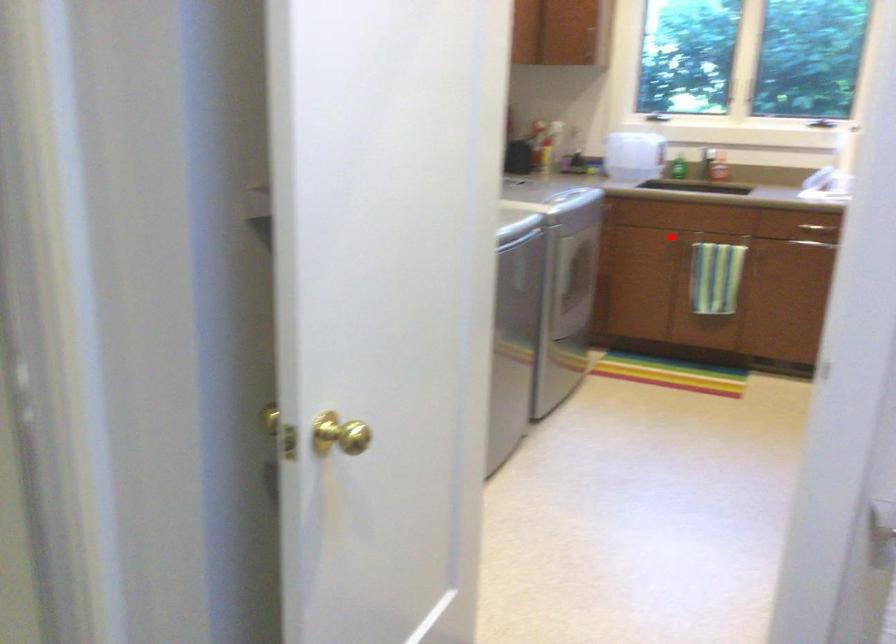
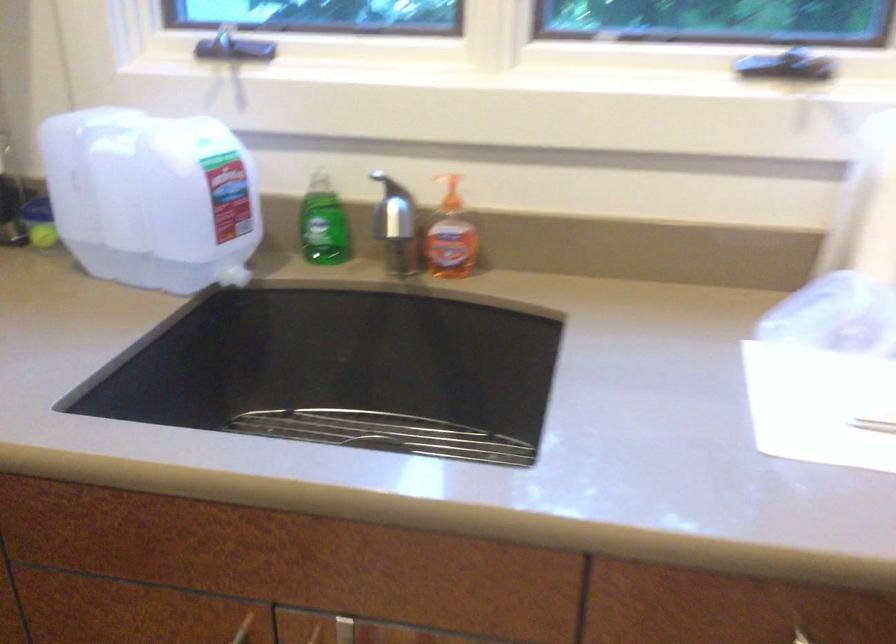
Question: I am providing you with two images of the same scene from different viewpoints. Image1 has a red point marked. In image2, the corresponding 3D location appears at what relative position? Reply with the corresponding letter.

Choices:
 (A) Closer
 (B) Farther

Answer: (A)